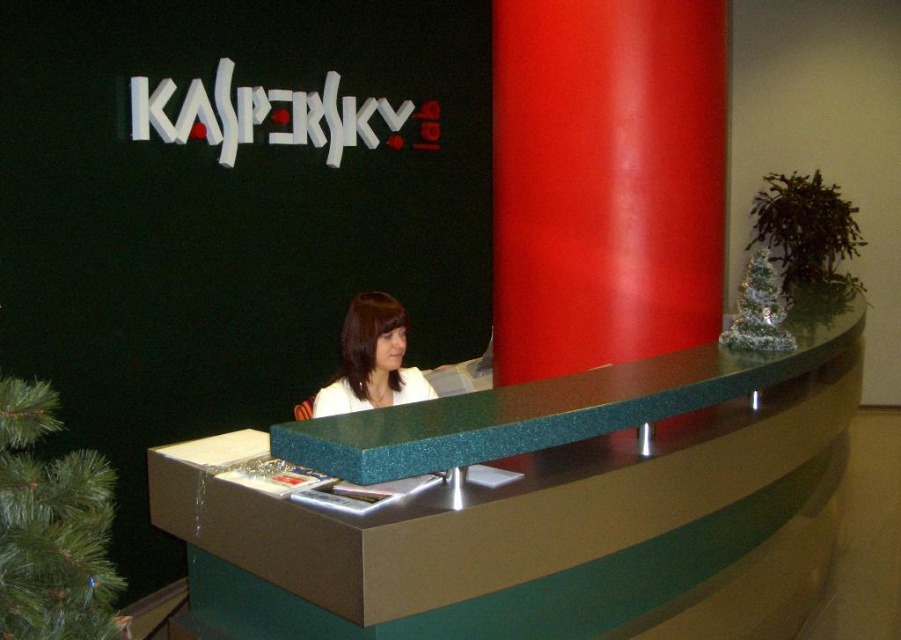
You are a customer entering the Kaspersky Lab office and need to reach the reception desk. You see the green speckled laminate desk at center and the white matte jacket at center. Which object is larger and would be easier to locate from a distance?

The green speckled laminate desk at center is bigger than the white matte jacket at center, so it would be easier to locate from a distance.

You are a visitor at the Kaspersky Lab office and want to approach the reception desk. From your perspective, is the green speckled laminate desk at center above or below the white matte jacket at center?

The green speckled laminate desk at center is located below the white matte jacket at center.

You are standing at the entrance of the Kaspersky Lab reception area. You need to approach the green speckled laminate desk at center to check in. However, there is a red glossy pillar at center in your path. Can you walk straight towards the desk without going around the pillar?

The green speckled laminate desk at center is closer to the viewer than the red glossy pillar at center, so you can walk straight towards the desk without needing to go around the pillar because the pillar is behind the desk.